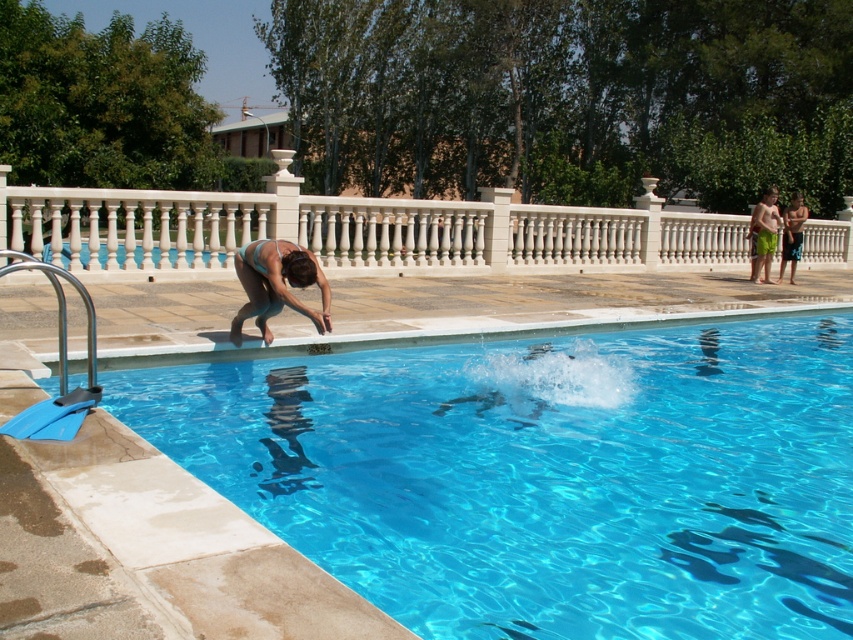
Is transparent blue water at center shorter than green fabric shorts at right?

Yes.

Is transparent blue water at center to the right of green fabric shorts at right from the viewer's perspective?

Incorrect, transparent blue water at center is not on the right side of green fabric shorts at right.

Is point (4, 465) more distant than point (772, 225)?

That is False.

At what (x,y) coordinates should I click in order to perform the action: click on transparent blue water at center. Please return your answer as a coordinate pair (x, y). This screenshot has width=853, height=640. Looking at the image, I should click on (149, 552).

Does transparent blue water at center appear on the right side of white marble railing at upper center?

In fact, transparent blue water at center is to the left of white marble railing at upper center.

Does transparent blue water at center have a lesser width compared to white marble railing at upper center?

Correct, transparent blue water at center's width is less than white marble railing at upper center's.

Who is more distant from viewer, [32,584] or [61,230]?

The point [61,230] is behind.

Identify the location of transparent blue water at center. (149, 552).

Is point (114, 618) positioned after point (258, 276)?

No.

Is transparent blue water at center shorter than matte blue swimsuit at lower left?

Yes, transparent blue water at center is shorter than matte blue swimsuit at lower left.

The height and width of the screenshot is (640, 853). I want to click on transparent blue water at center, so click(x=149, y=552).